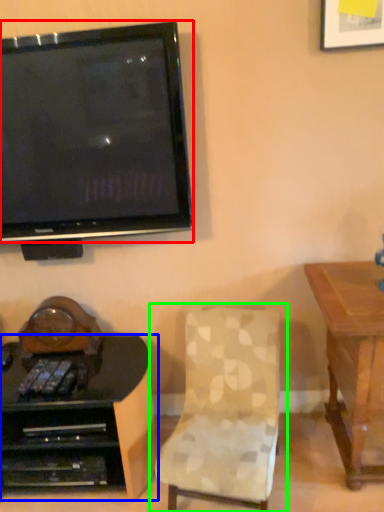
Question: Which is nearer to the television (highlighted by a red box)? desk (highlighted by a blue box) or chair (highlighted by a green box).

Choices:
 (A) desk
 (B) chair

Answer: (B)